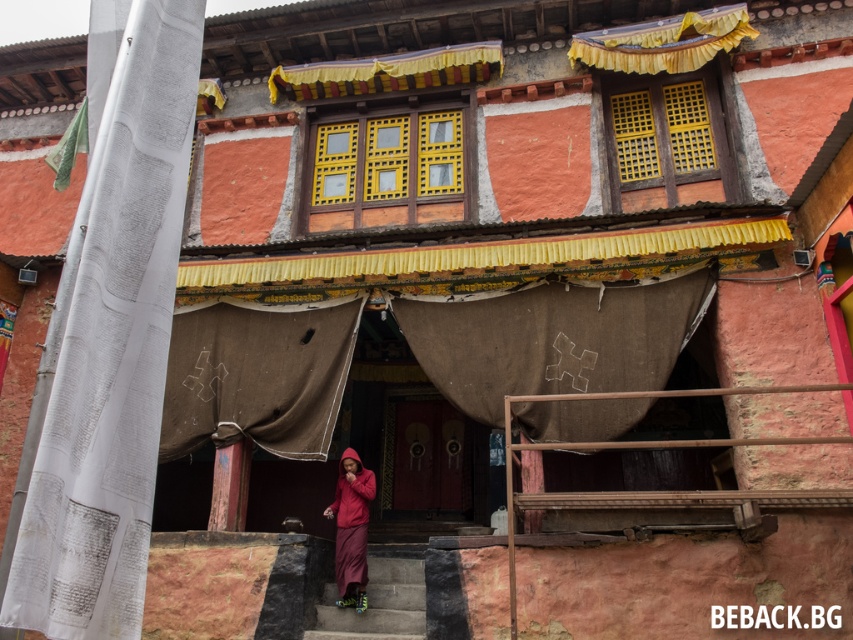
Between concrete stairs at center and matte red robe at center, which one is positioned higher?

matte red robe at center is above.

Who is taller, concrete stairs at center or matte red robe at center?

Standing taller between the two is matte red robe at center.

This screenshot has width=853, height=640. What are the coordinates of `concrete stairs at center` in the screenshot? It's located at (379, 598).

Identify the location of concrete stairs at center. (379, 598).